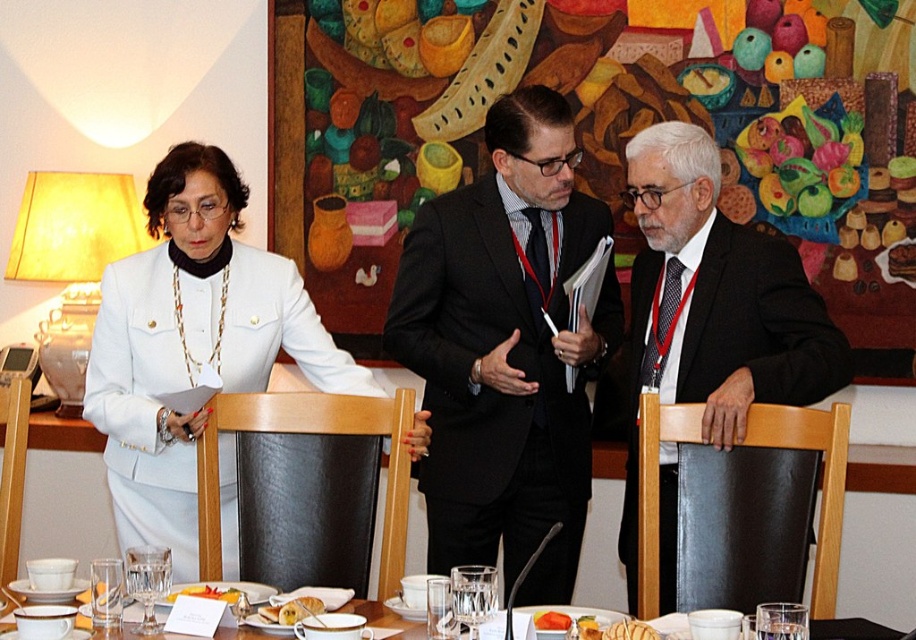
From the picture: In the formal meeting scene, there is a dark gray suit at right and a golden bread at center. Which object is positioned to the right of the other?

The dark gray suit at right is positioned to the right of the golden bread at center.

You are standing at point A, which is at coordinate point A at (451, 259) and point B at (849, 637). If you want to walk from point A to point B, will you be moving towards the foreground or background of the image?

Moving from point A at (451, 259) to point B at (849, 637) would be moving towards the background since point A is behind point B.